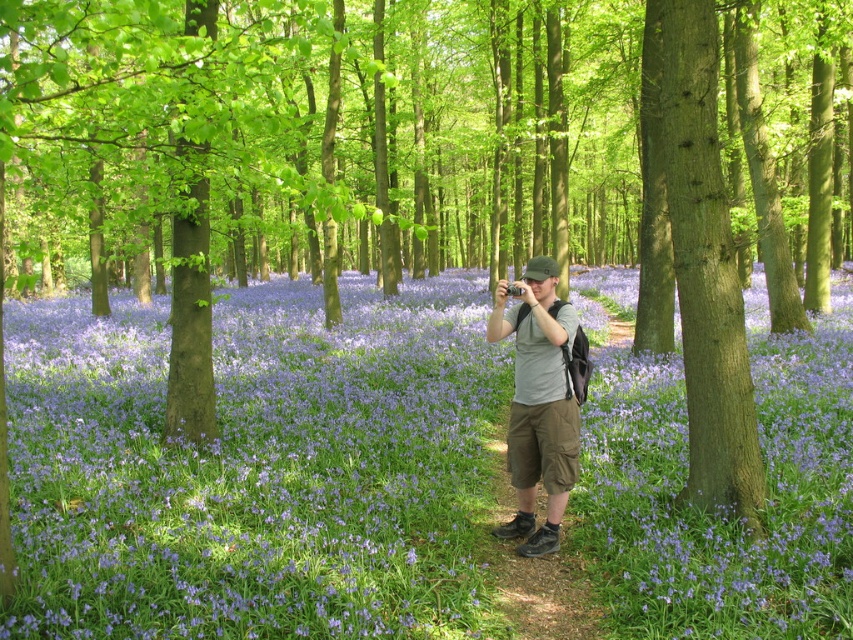
Is purple matte flower at center below smooth brown tree trunk at center?

Correct, purple matte flower at center is located below smooth brown tree trunk at center.

Is purple matte flower at center smaller than smooth brown tree trunk at center?

Actually, purple matte flower at center might be larger than smooth brown tree trunk at center.

What are the coordinates of `purple matte flower at center` in the screenshot? It's located at (257, 468).

The width and height of the screenshot is (853, 640). In order to click on purple matte flower at center in this screenshot , I will do `click(257, 468)`.

Is purple matte flower at center shorter than matte gray t-shirt at center?

Incorrect, purple matte flower at center's height does not fall short of matte gray t-shirt at center's.

Who is more forward, (401, 296) or (527, 276)?

Point (527, 276) is more forward.

Which is in front, point (242, 317) or point (553, 307)?

Point (553, 307) is in front.

Locate an element on the screen. This screenshot has width=853, height=640. purple matte flower at center is located at coordinates (257, 468).

From the picture: Can you confirm if smooth brown tree trunk at center is thinner than matte gray t-shirt at center?

No, smooth brown tree trunk at center is not thinner than matte gray t-shirt at center.

Is smooth brown tree trunk at center further to the viewer compared to matte gray t-shirt at center?

No, it is in front of matte gray t-shirt at center.

Is point (737, 358) positioned after point (553, 307)?

No.

Locate an element on the screen. This screenshot has height=640, width=853. smooth brown tree trunk at center is located at coordinates (706, 272).